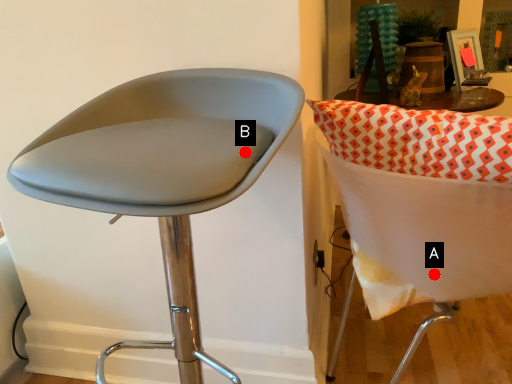
Question: Two points are circled on the image, labeled by A and B beside each circle. Which point is closer to the camera taking this photo?

Choices:
 (A) A is closer
 (B) B is closer

Answer: (B)